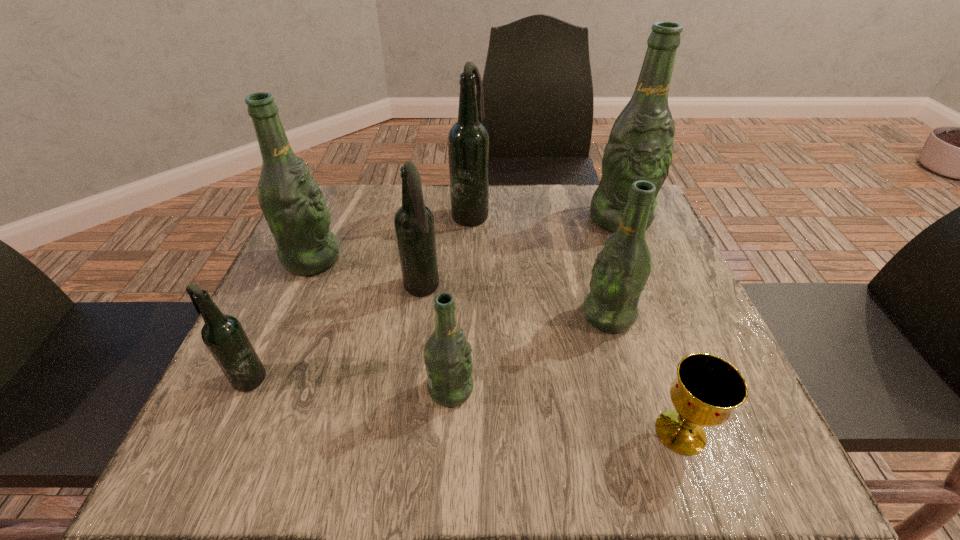
Locate which green beer bottle is the second closest to the shortest object. Please provide its 2D coordinates. Your answer should be formatted as a tuple, i.e. [(x, y)], where the tuple contains the x and y coordinates of a point satisfying the conditions above.

[(447, 354)]

Identify which green beer bottle is the nearest to the chalice. Please provide its 2D coordinates. Your answer should be formatted as a tuple, i.e. [(x, y)], where the tuple contains the x and y coordinates of a point satisfying the conditions above.

[(620, 272)]

Identify which dark beer bottle is located as the third nearest to the third smallest green beer bottle. Please provide its 2D coordinates. Your answer should be formatted as a tuple, i.e. [(x, y)], where the tuple contains the x and y coordinates of a point satisfying the conditions above.

[(468, 140)]

Choose which dark beer bottle is the nearest neighbor to the biggest green beer bottle. Please provide its 2D coordinates. Your answer should be formatted as a tuple, i.e. [(x, y)], where the tuple contains the x and y coordinates of a point satisfying the conditions above.

[(468, 140)]

At what (x,y) coordinates should I click in order to perform the action: click on vacant area that satisfies the following two spatial constraints: 1. on the surface of the gold chalice; 2. on the left side of the nearest green beer bottle. Please return your answer as a coordinate pair (x, y). Looking at the image, I should click on (448, 432).

I want to click on free space that satisfies the following two spatial constraints: 1. on the front side of the second farthest dark beer bottle; 2. on the left side of the gold chalice, so click(401, 432).

Where is `free location that satisfies the following two spatial constraints: 1. on the surface of the gold chalice; 2. on the right side of the third biggest green beer bottle`? free location that satisfies the following two spatial constraints: 1. on the surface of the gold chalice; 2. on the right side of the third biggest green beer bottle is located at coordinates (642, 432).

Identify the location of free point that satisfies the following two spatial constraints: 1. on the surface of the chalice; 2. on the right side of the leftmost green beer bottle. The height and width of the screenshot is (540, 960). (238, 432).

You are a GUI agent. You are given a task and a screenshot of the screen. Output one action in this format:
    pyautogui.click(x=<x>, y=<y>)
    Task: Click on the vacant space that satisfies the following two spatial constraints: 1. on the surface of the tallest beer bottle; 2. on the surface of the second nearest green beer bottle
    
    Given the screenshot: What is the action you would take?
    pyautogui.click(x=659, y=316)

Where is `free space in the image that satisfies the following two spatial constraints: 1. on the front side of the rightmost dark beer bottle; 2. on the left side of the shortest object`? free space in the image that satisfies the following two spatial constraints: 1. on the front side of the rightmost dark beer bottle; 2. on the left side of the shortest object is located at coordinates (464, 432).